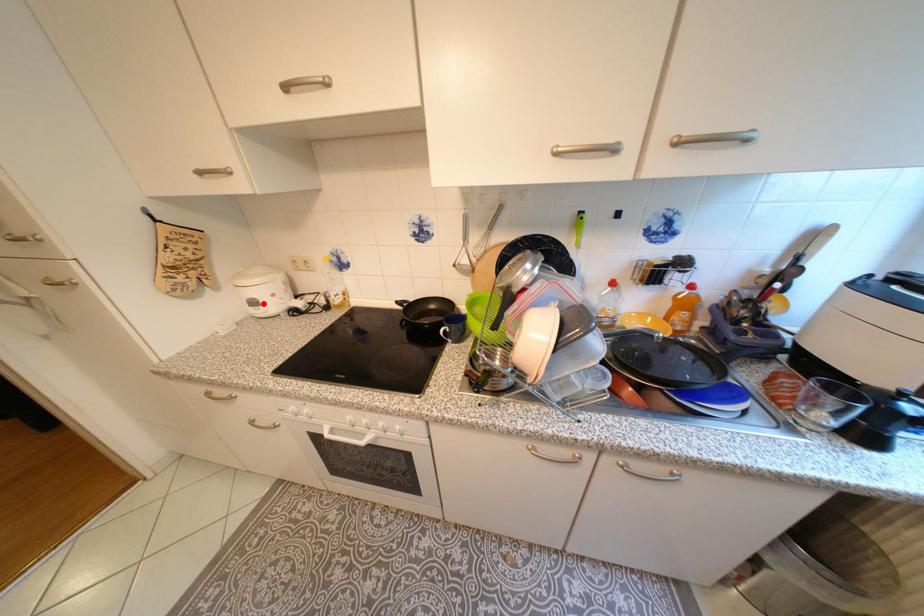
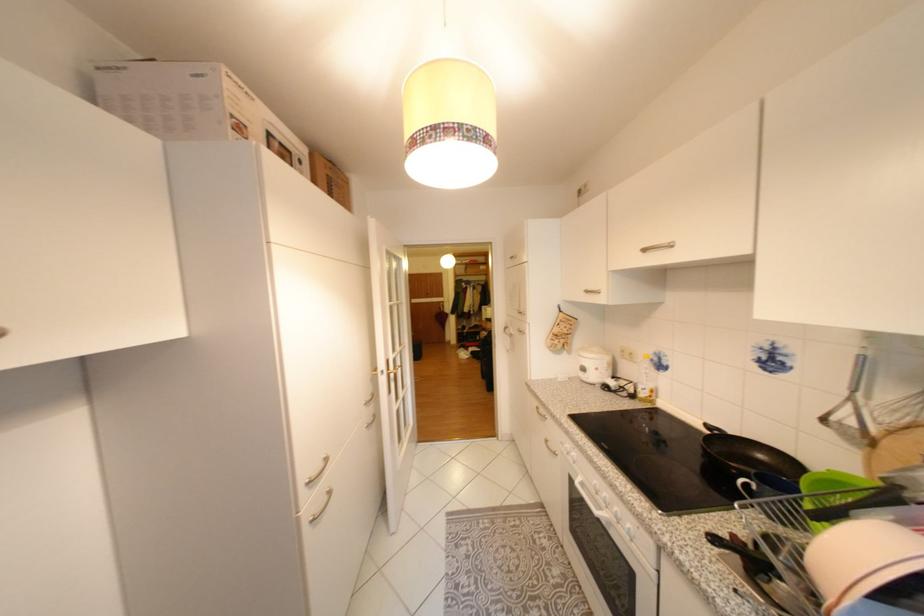
The point at the highlighted location is marked in the first image. Where is the corresponding point in the second image?

(592, 370)